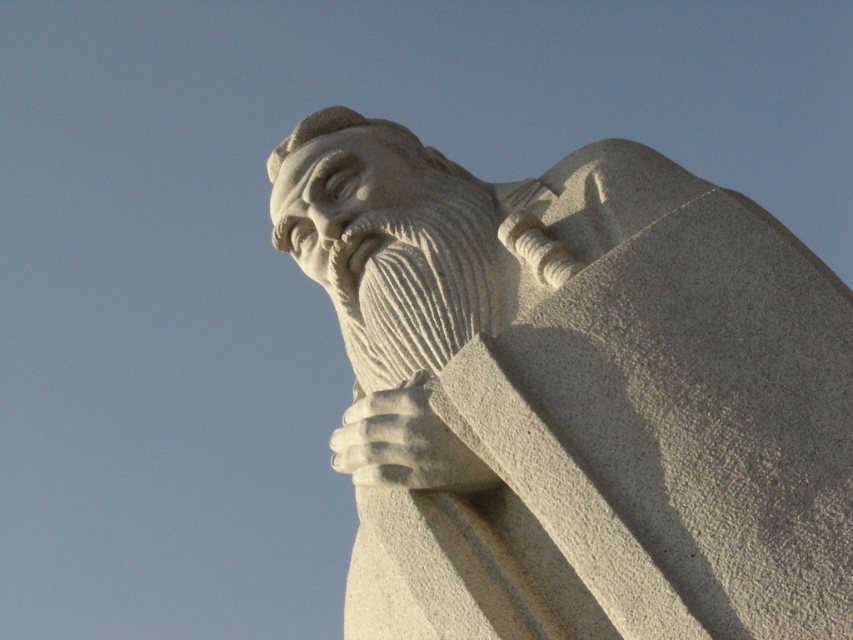
Who is more distant from viewer, (x=544, y=340) or (x=403, y=420)?

The point (x=403, y=420) is more distant.

Is point (746, 413) positioned before point (428, 429)?

Yes.

Who is more forward, (x=830, y=509) or (x=422, y=467)?

Point (x=830, y=509)

The image size is (853, 640). Identify the location of white stone statue at center. (575, 394).